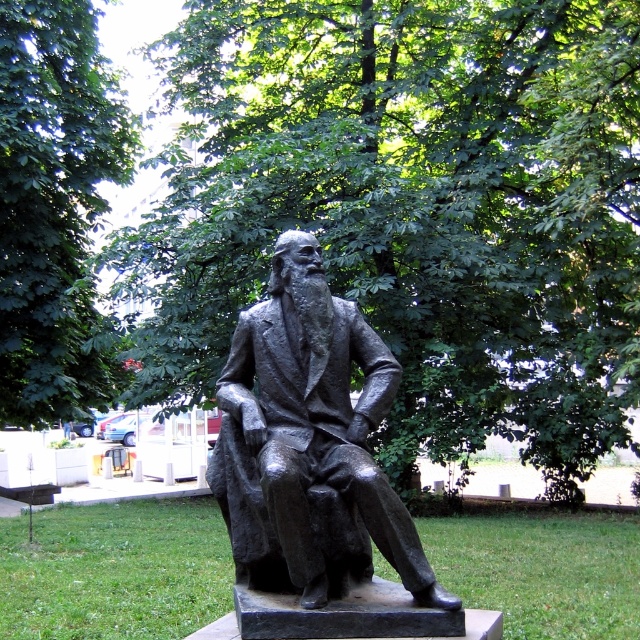
You are standing at the base of the statue and want to walk towards the point labeled point (369, 465). Which direction should you walk relative to the other point labeled point (35, 163)?

You should walk towards point (369, 465), which is in front of point (35, 163). Since point (369, 465) is in front of point (35, 163), walking towards it would mean moving forward relative to the statue.

You are standing in a park and see the bronze statue at center. If you want to touch the statue, how many steps do you need to take to reach it?

The bronze statue at center is 4.49 meters away from you. Assuming an average step length of about 0.75 meters, you would need to take approximately 6 steps to reach it.